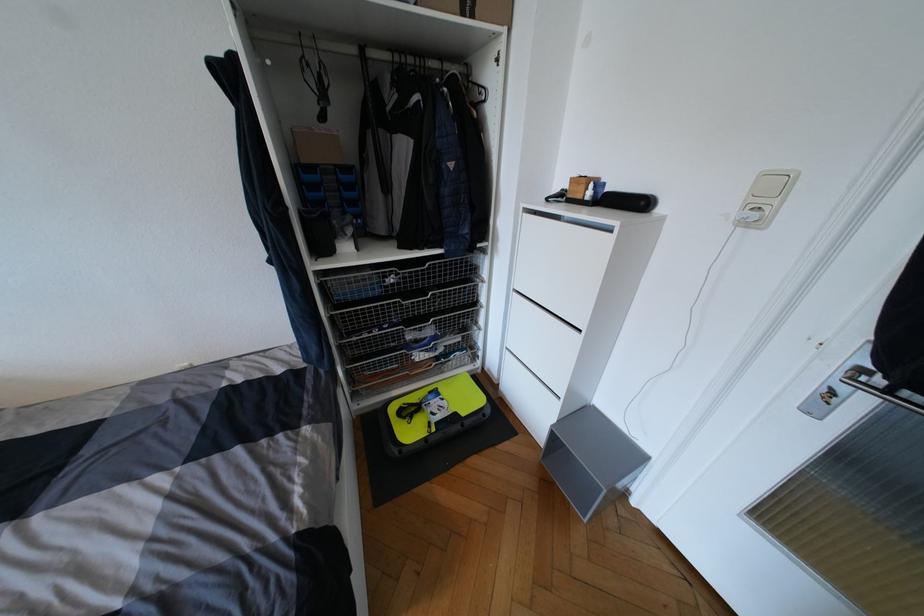
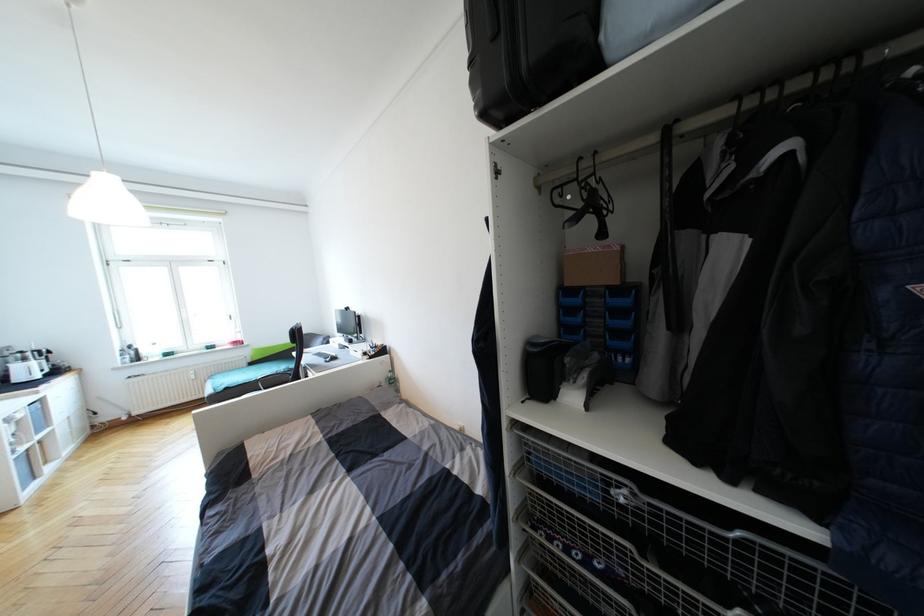
In the second image, find the point that corresponds to (385,274) in the first image.

(604, 476)